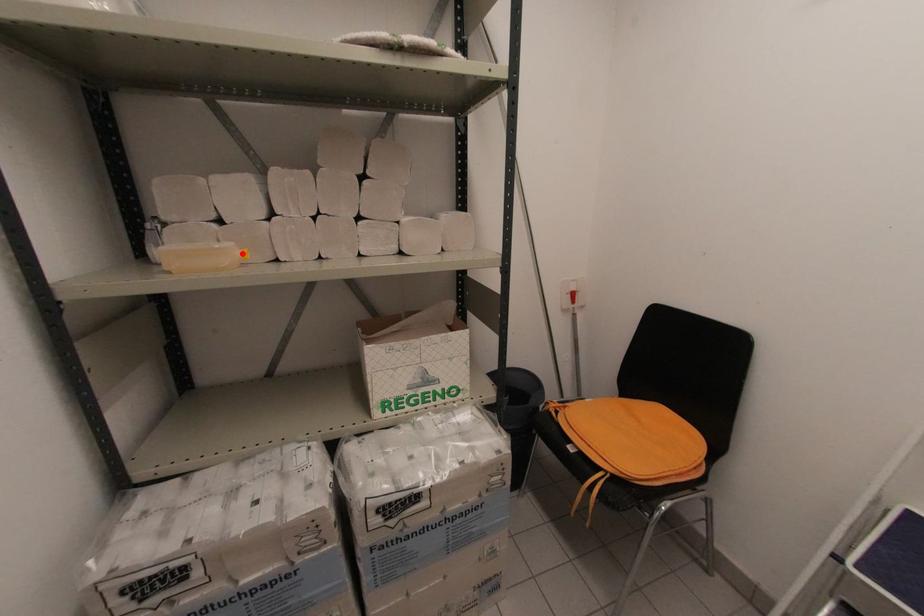
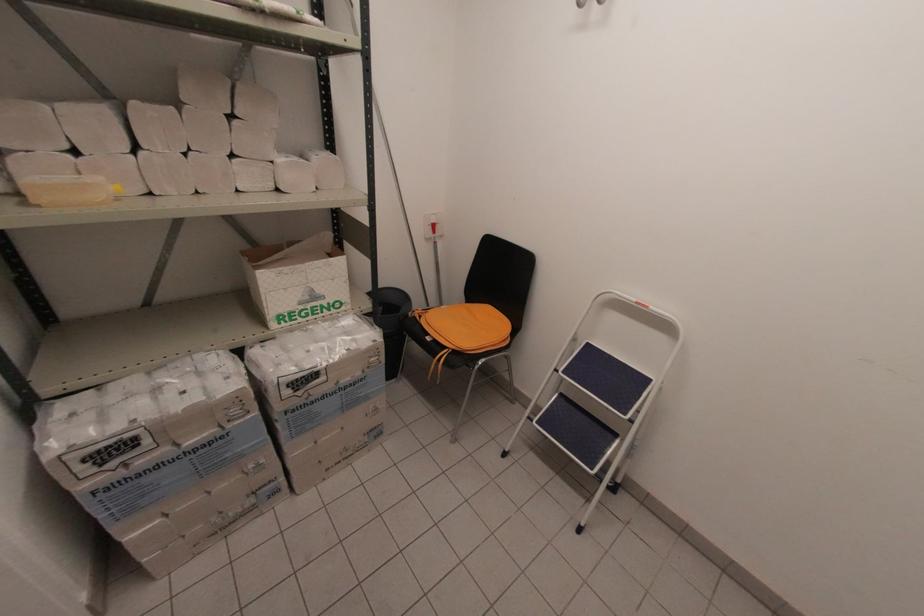
In the second image, find the point that corresponds to the highlighted location in the first image.

(116, 188)